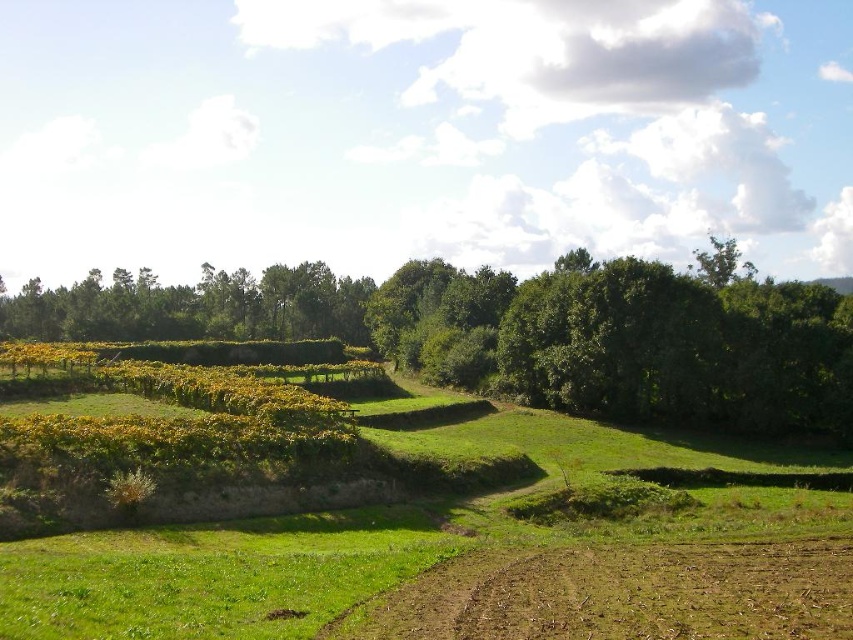
Is green leafy tree at left smaller than brown soil at lower center?

Incorrect, green leafy tree at left is not smaller in size than brown soil at lower center.

Who is more forward, (663, 276) or (718, 632)?

Point (718, 632)

Is point (468, 374) closer to viewer compared to point (795, 618)?

No, (468, 374) is further to viewer.

This screenshot has width=853, height=640. Identify the location of green leafy tree at left. (521, 332).